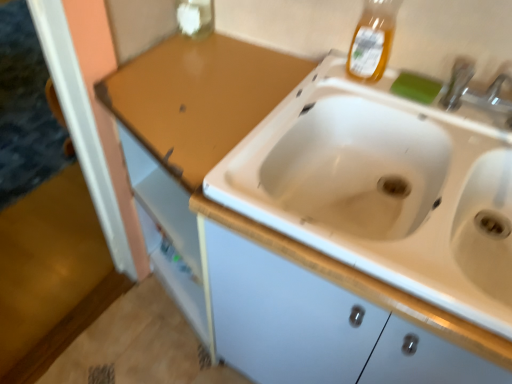
Identify the location of space that is in front of green sponge at upper right. Image resolution: width=512 pixels, height=384 pixels. (443, 123).